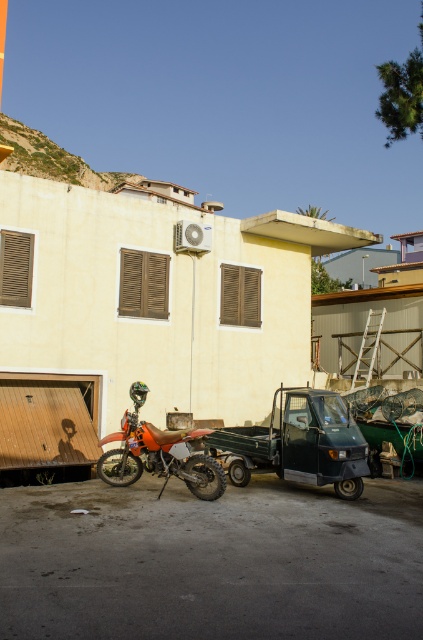
Question: Which object appears closest to the camera in this image?

Choices:
 (A) green matte pickup truck at center
 (B) orange matte dirt bike at center

Answer: (B)

Question: Observing the image, what is the correct spatial positioning of green matte pickup truck at center in reference to orange matte dirt bike at center?

Choices:
 (A) left
 (B) right

Answer: (B)

Question: Is green matte pickup truck at center in front of orange matte dirt bike at center?

Choices:
 (A) yes
 (B) no

Answer: (B)

Question: Where is green matte pickup truck at center located in relation to orange matte dirt bike at center in the image?

Choices:
 (A) left
 (B) right

Answer: (B)

Question: Among these objects, which one is farthest from the camera?

Choices:
 (A) green matte pickup truck at center
 (B) orange matte dirt bike at center

Answer: (A)